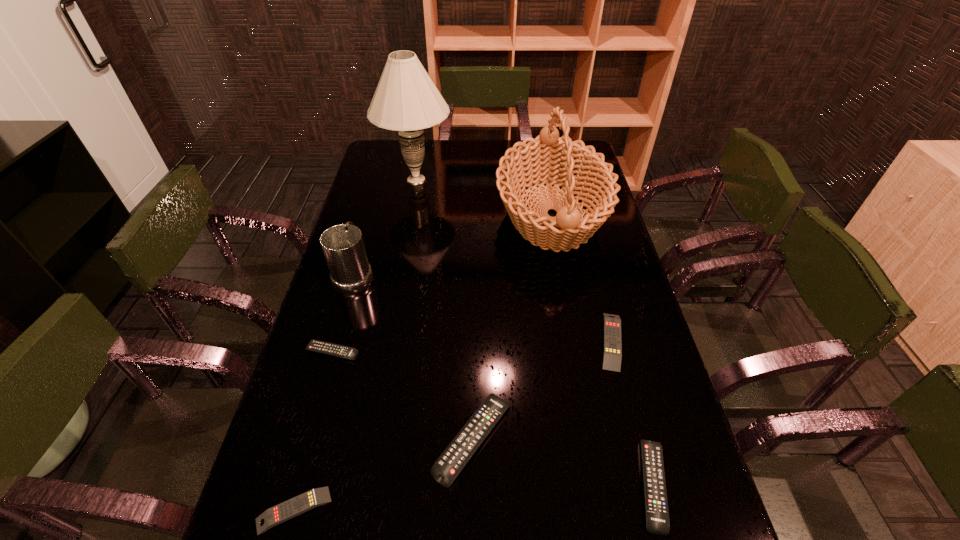
This screenshot has width=960, height=540. I want to click on vacant area that lies between the lampshade and the gray mug, so click(386, 226).

Locate an element on the screen. The width and height of the screenshot is (960, 540). vacant point located between the biggest black remote control and the right yellow remote control is located at coordinates 541,390.

In order to click on free space between the second tallest object and the rightmost black remote control in this screenshot , I will do `click(602, 350)`.

Select which object appears as the sixth closest to the gray mug. Please provide its 2D coordinates. Your answer should be formatted as a tuple, i.e. [(x, y)], where the tuple contains the x and y coordinates of a point satisfying the conditions above.

[(612, 345)]

The height and width of the screenshot is (540, 960). I want to click on object that is the sixth closest one to the left yellow remote control, so click(x=548, y=159).

Locate an element on the screen. Image resolution: width=960 pixels, height=540 pixels. remote control object that ranks as the fifth closest to the mug is located at coordinates (656, 506).

Find the location of `remote control that stands as the fourth closest to the third tallest object`. remote control that stands as the fourth closest to the third tallest object is located at coordinates (612, 345).

The width and height of the screenshot is (960, 540). Find the location of `the closest black remote control to the second smallest black remote control`. the closest black remote control to the second smallest black remote control is located at coordinates [448, 466].

Where is `the second closest black remote control to the right yellow remote control`? the second closest black remote control to the right yellow remote control is located at coordinates pyautogui.click(x=448, y=466).

In order to click on vacant space that satisfies the following two spatial constraints: 1. on the side of the lampshade with the handle; 2. on the left side of the mug in this screenshot , I will do `click(381, 180)`.